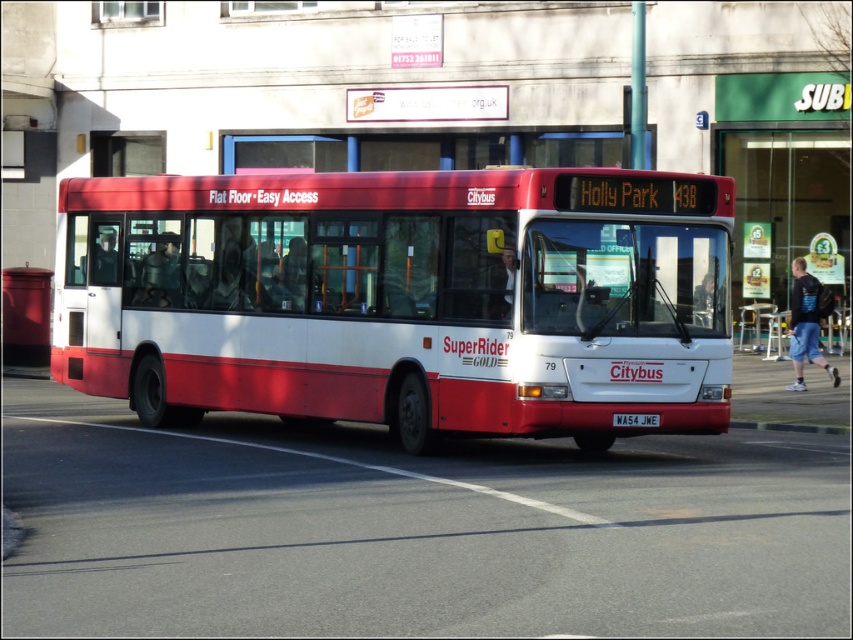
Does matte red bus at center appear on the right side of green glass door at upper center?

No, matte red bus at center is not to the right of green glass door at upper center.

Can you confirm if matte red bus at center is shorter than green glass door at upper center?

Indeed, matte red bus at center has a lesser height compared to green glass door at upper center.

Locate an element on the screen. Image resolution: width=853 pixels, height=640 pixels. matte red bus at center is located at coordinates (403, 300).

Identify the location of matte red bus at center. This screenshot has width=853, height=640. (403, 300).